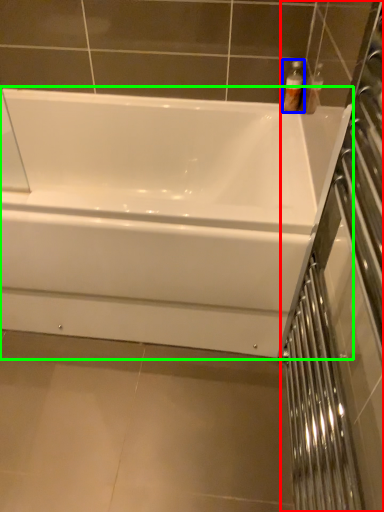
Question: Based on their relative distances, which object is farther from screen door (highlighted by a red box)? Choose from toiletry (highlighted by a blue box) and bathtub (highlighted by a green box).

Choices:
 (A) toiletry
 (B) bathtub

Answer: (A)